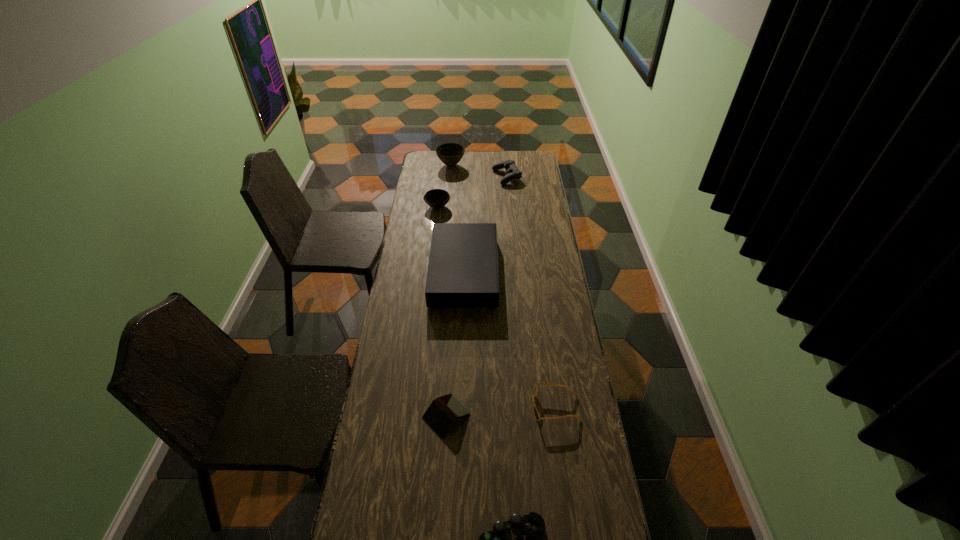
The height and width of the screenshot is (540, 960). Find the location of `object positioned at the far left corner`. object positioned at the far left corner is located at coordinates (450, 154).

In order to click on object located in the far right corner section of the desktop in this screenshot , I will do `click(513, 173)`.

At what (x,y) coordinates should I click in order to perform the action: click on vacant area at the left edge. Please return your answer as a coordinate pair (x, y). This screenshot has height=540, width=960. Looking at the image, I should click on (402, 269).

The height and width of the screenshot is (540, 960). What are the coordinates of `vacant space at the right edge of the desktop` in the screenshot? It's located at (564, 307).

Where is `free space at the far left corner of the desktop`? free space at the far left corner of the desktop is located at coordinates (428, 167).

The width and height of the screenshot is (960, 540). Identify the location of free area in between the shorter bowl and the book. (442, 311).

Find the location of a particular element. This screenshot has height=540, width=960. unoccupied area between the taller control and the farther bowl is located at coordinates (479, 171).

Locate an element on the screen. vacant space in between the fifth nearest object and the book is located at coordinates (442, 311).

Find the location of a particular element. The width and height of the screenshot is (960, 540). the fourth closest object to the farther bowl is located at coordinates (443, 411).

Select which object is the sixth closest to the farther control. Please provide its 2D coordinates. Your answer should be formatted as a tuple, i.e. [(x, y)], where the tuple contains the x and y coordinates of a point satisfying the conditions above.

[(510, 539)]